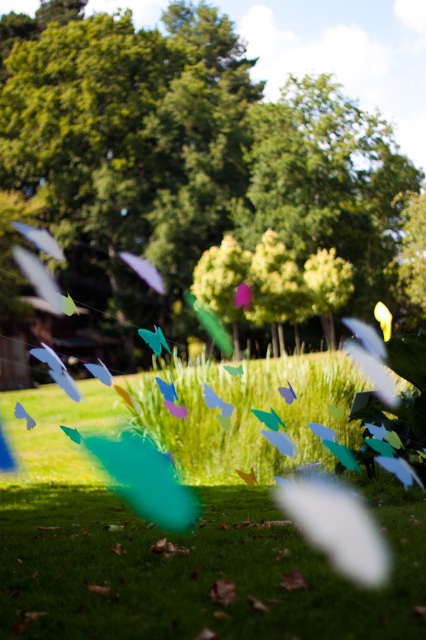
You are a gardener planning to plant a new row of flowers between the green leafy tree at center and the green matte grass at center. Which area has more space to accommodate the flowers?

The green leafy tree at center has a larger width than the green matte grass at center, so there is more space available around the green leafy tree at center to plant the flowers.

You are standing in the garden and want to place a small statue between the two points, point [218,202] and point [172,614]. Which point should the statue be closer to in order to be nearer to the viewer?

The statue should be closer to point [218,202] because it is closer to the viewer than point [172,614].